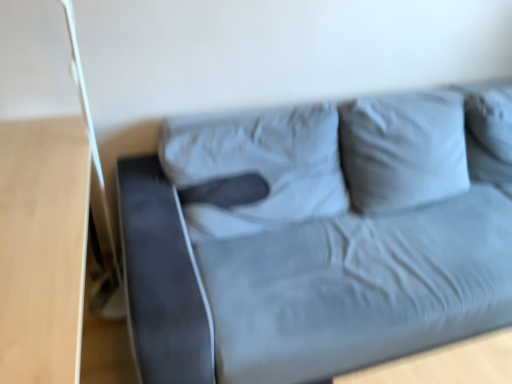
Question: Is light wood table at left oriented away from suede gray couch at center?

Choices:
 (A) no
 (B) yes

Answer: (A)

Question: From the image's perspective, is light wood table at left below suede gray couch at center?

Choices:
 (A) yes
 (B) no

Answer: (A)

Question: Is light wood table at left at the left side of suede gray couch at center?

Choices:
 (A) yes
 (B) no

Answer: (A)

Question: Could you tell me if light wood table at left is turned towards suede gray couch at center?

Choices:
 (A) no
 (B) yes

Answer: (B)

Question: Considering the relative sizes of light wood table at left and suede gray couch at center in the image provided, is light wood table at left taller than suede gray couch at center?

Choices:
 (A) yes
 (B) no

Answer: (B)

Question: Is light wood table at left shorter than suede gray couch at center?

Choices:
 (A) yes
 (B) no

Answer: (A)

Question: Can you confirm if suede gray couch at center is taller than light wood table at left?

Choices:
 (A) no
 (B) yes

Answer: (B)

Question: Can you confirm if suede gray couch at center is positioned to the right of light wood table at left?

Choices:
 (A) no
 (B) yes

Answer: (B)

Question: Considering the relative sizes of suede gray couch at center and light wood table at left in the image provided, is suede gray couch at center bigger than light wood table at left?

Choices:
 (A) yes
 (B) no

Answer: (A)

Question: Is suede gray couch at center wider than light wood table at left?

Choices:
 (A) no
 (B) yes

Answer: (B)

Question: Is suede gray couch at center in front of light wood table at left?

Choices:
 (A) yes
 (B) no

Answer: (B)

Question: From a real-world perspective, is suede gray couch at center over light wood table at left?

Choices:
 (A) yes
 (B) no

Answer: (A)

Question: Does point (489, 327) appear closer or farther from the camera than point (64, 294)?

Choices:
 (A) closer
 (B) farther

Answer: (B)